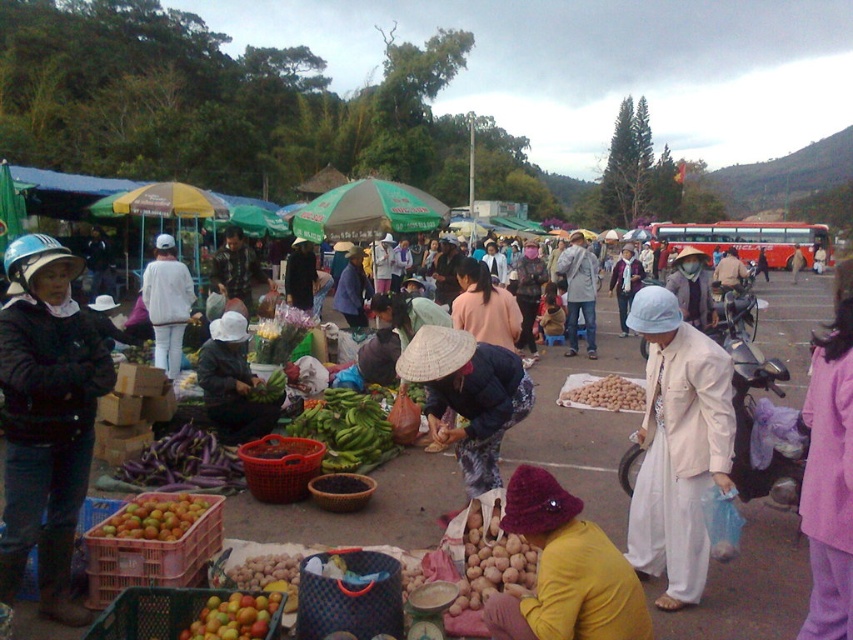
Who is positioned more to the right, matte black jacket at left or white matte pants at center?

matte black jacket at left is more to the right.

Does matte black jacket at left appear over white matte pants at center?

Actually, matte black jacket at left is below white matte pants at center.

Is point (0, 420) less distant than point (170, 257)?

Yes, point (0, 420) is in front of point (170, 257).

Where is `matte black jacket at left`? Image resolution: width=853 pixels, height=640 pixels. matte black jacket at left is located at coordinates (45, 419).

Does dark green fabric at center have a larger size compared to orange matte fruit at lower left?

Correct, dark green fabric at center is larger in size than orange matte fruit at lower left.

From the picture: Which is above, dark green fabric at center or orange matte fruit at lower left?

dark green fabric at center

This screenshot has height=640, width=853. Describe the element at coordinates (231, 384) in the screenshot. I see `dark green fabric at center` at that location.

The width and height of the screenshot is (853, 640). In order to click on dark green fabric at center in this screenshot , I will do `click(231, 384)`.

In the scene shown: Can you confirm if green matte bananas at center is shorter than ripe tomato at center?

Incorrect, green matte bananas at center's height does not fall short of ripe tomato at center's.

Is point (367, 397) behind point (276, 609)?

Yes.

Is point (316, 413) less distant than point (250, 605)?

No.

I want to click on green matte bananas at center, so click(346, 429).